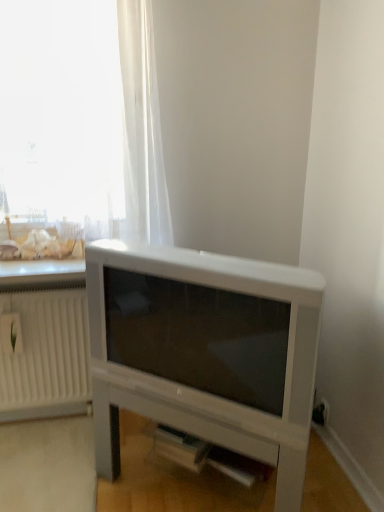
Locate an element on the screen. The height and width of the screenshot is (512, 384). free space on the front side of white plastic radiator at left is located at coordinates (40, 451).